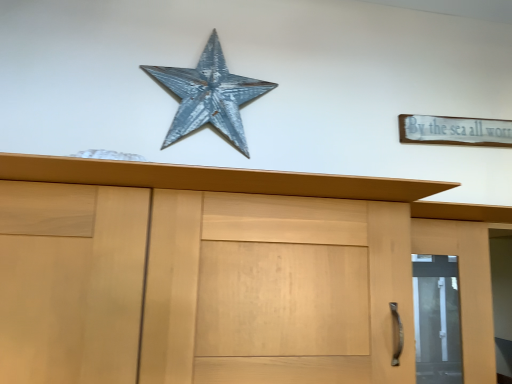
Question: Is point (462, 120) closer or farther from the camera than point (227, 74)?

Choices:
 (A) closer
 (B) farther

Answer: (B)

Question: Relative to rusty metal star at upper center, is white wood sign at upper right in front or behind?

Choices:
 (A) front
 (B) behind

Answer: (B)

Question: Which object is the farthest from the rusty metal star at upper center?

Choices:
 (A) white wood sign at upper right
 (B) matte wood door at right

Answer: (B)

Question: Considering the real-world distances, which object is farthest from the white wood sign at upper right?

Choices:
 (A) matte wood door at right
 (B) rusty metal star at upper center

Answer: (B)